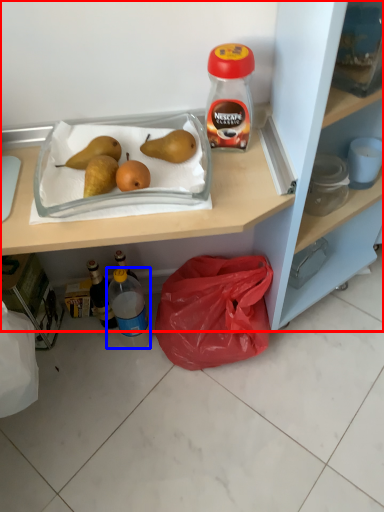
Question: Which object is closer to the camera taking this photo, cabinetry (highlighted by a red box) or bottle (highlighted by a blue box)?

Choices:
 (A) cabinetry
 (B) bottle

Answer: (A)